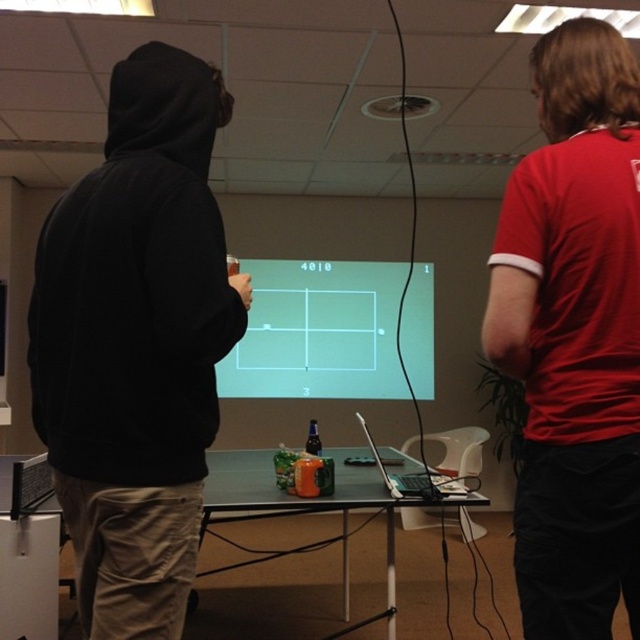
You are trying to place a new item on the surface between the green plastic table at center and the silver metallic laptop at center. Based on their heights, which object should you place the item on to ensure it stays elevated?

The green plastic table at center has a greater height compared to the silver metallic laptop at center, so placing the item on the green plastic table at center will keep it more elevated.

You are setting up a projector that requires a surface at least 1.5 meters tall to display properly. You have two options in the room, the green matte projection screen at center and the green plastic table at center. Which surface would be suitable for the projector?

The green matte projection screen at center is much taller than the green plastic table at center, so the green matte projection screen at center would be suitable for the projector as it meets the height requirement of 1.5 meters.

You are a person who is 1.8 meters tall and standing in front of the green plastic table at center. If you want to grab a snack from the table, can you comfortably reach it without moving your feet?

The green plastic table at center and viewer are 1.92 meters apart. Since the distance between you and the table is greater than your height of 1.8 meters, you would not be able to comfortably reach the snacks on the table without moving closer.